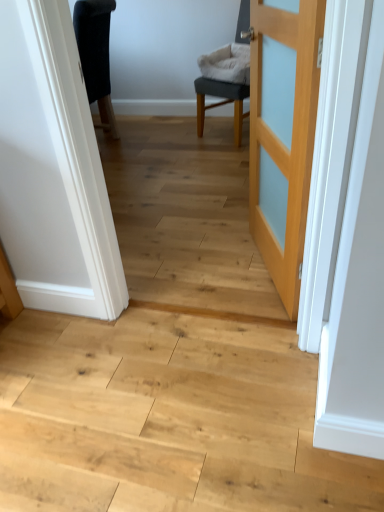
Question: Considering the relative sizes of gray fabric chair at center and natural wood floor at center in the image provided, is gray fabric chair at center wider than natural wood floor at center?

Choices:
 (A) yes
 (B) no

Answer: (B)

Question: From the image's perspective, is gray fabric chair at center located above natural wood floor at center?

Choices:
 (A) no
 (B) yes

Answer: (B)

Question: Does gray fabric chair at center have a smaller size compared to natural wood floor at center?

Choices:
 (A) no
 (B) yes

Answer: (A)

Question: Is gray fabric chair at center outside natural wood floor at center?

Choices:
 (A) no
 (B) yes

Answer: (B)

Question: Is the position of gray fabric chair at center more distant than that of natural wood floor at center?

Choices:
 (A) no
 (B) yes

Answer: (B)

Question: Is point (218, 95) positioned closer to the camera than point (69, 351)?

Choices:
 (A) closer
 (B) farther

Answer: (B)

Question: Visually, is gray fabric chair at center positioned to the left or to the right of natural wood floor at center?

Choices:
 (A) left
 (B) right

Answer: (B)

Question: Considering their positions, is gray fabric chair at center located in front of or behind natural wood floor at center?

Choices:
 (A) behind
 (B) front

Answer: (A)

Question: Considering the positions of gray fabric chair at center and natural wood floor at center in the image, is gray fabric chair at center bigger or smaller than natural wood floor at center?

Choices:
 (A) small
 (B) big

Answer: (B)

Question: From the image's perspective, is light wood door at center located above or below natural wood floor at center?

Choices:
 (A) above
 (B) below

Answer: (A)

Question: Looking at their shapes, would you say light wood door at center is wider or thinner than natural wood floor at center?

Choices:
 (A) wide
 (B) thin

Answer: (B)

Question: In the image, is light wood door at center on the left side or the right side of natural wood floor at center?

Choices:
 (A) left
 (B) right

Answer: (B)

Question: Is light wood door at center inside or outside of natural wood floor at center?

Choices:
 (A) inside
 (B) outside

Answer: (B)

Question: Is point (296, 237) closer or farther from the camera than point (218, 103)?

Choices:
 (A) closer
 (B) farther

Answer: (A)

Question: Considering the positions of light wood door at center and gray fabric chair at center in the image, is light wood door at center wider or thinner than gray fabric chair at center?

Choices:
 (A) thin
 (B) wide

Answer: (A)